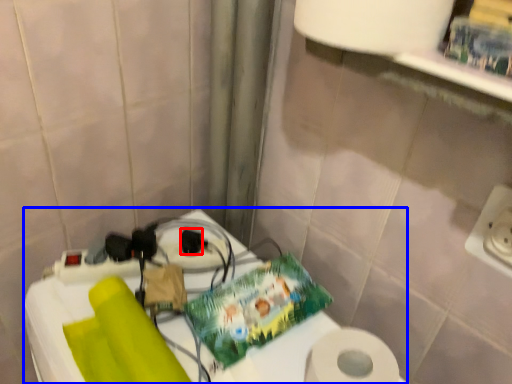
Question: Which point is closer to the camera, socket (highlighted by a red box) or table (highlighted by a blue box)?

Choices:
 (A) socket
 (B) table

Answer: (B)